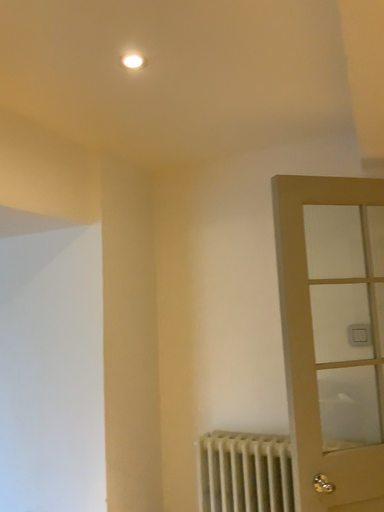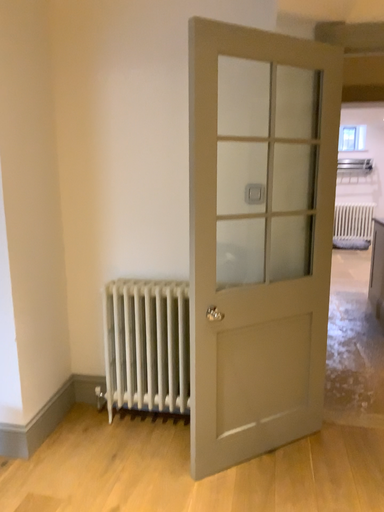
Question: Which way did the camera rotate in the video?

Choices:
 (A) rotated downward
 (B) rotated upward

Answer: (A)